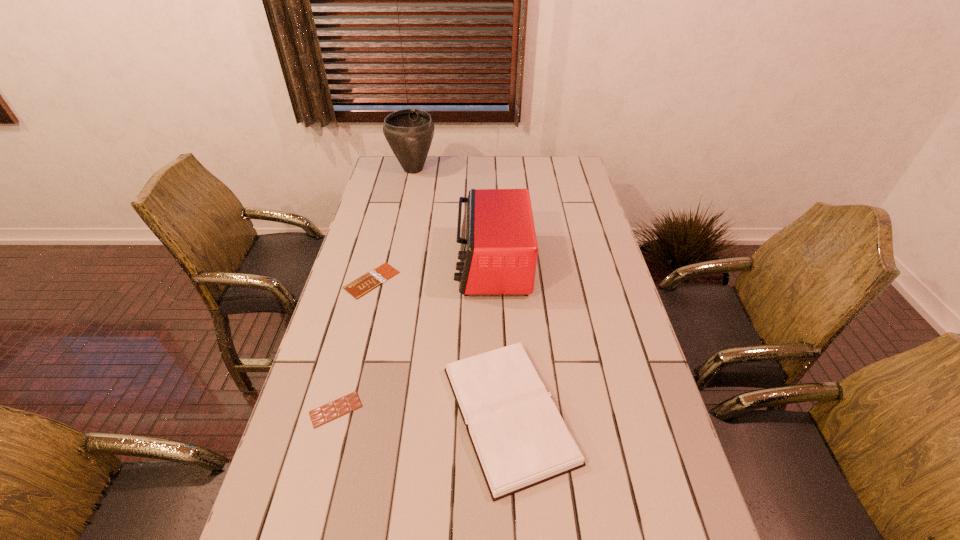
Locate an element on the screen. This screenshot has height=540, width=960. unoccupied area between the hardback book and the second tallest object is located at coordinates (500, 339).

Identify the location of free space between the second tallest object and the urn. Image resolution: width=960 pixels, height=540 pixels. (453, 217).

Identify the location of object that ranks as the fourth closest to the tallest object. The image size is (960, 540). (348, 403).

Point out which object is positioned as the fourth nearest to the shortest object. Please provide its 2D coordinates. Your answer should be formatted as a tuple, i.e. [(x, y)], where the tuple contains the x and y coordinates of a point satisfying the conditions above.

[(409, 132)]

Image resolution: width=960 pixels, height=540 pixels. I want to click on vacant space that satisfies the following two spatial constraints: 1. on the back side of the farther chocolate bar; 2. on the right side of the nearer chocolate bar, so click(370, 280).

I want to click on free space that satisfies the following two spatial constraints: 1. on the front-facing side of the second tallest object; 2. on the front side of the second shortest object, so pos(497,409).

Where is `vacant area in the image that satisfies the following two spatial constraints: 1. on the front side of the tallest object; 2. on the left side of the third shortest object`? This screenshot has height=540, width=960. vacant area in the image that satisfies the following two spatial constraints: 1. on the front side of the tallest object; 2. on the left side of the third shortest object is located at coordinates (360, 414).

Locate an element on the screen. free location that satisfies the following two spatial constraints: 1. on the front-facing side of the toaster oven; 2. on the right side of the third shortest object is located at coordinates (497, 414).

The height and width of the screenshot is (540, 960). Find the location of `vacant space that satisfies the following two spatial constraints: 1. on the back side of the third tallest object; 2. on the front-facing side of the second tallest object`. vacant space that satisfies the following two spatial constraints: 1. on the back side of the third tallest object; 2. on the front-facing side of the second tallest object is located at coordinates (501, 265).